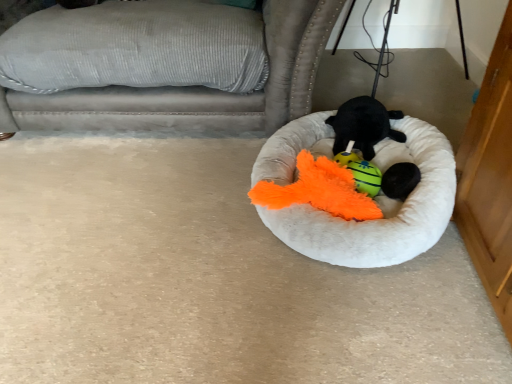
Where is `free space between gray corduroy couch at upper left and white fluffy dog bed at center`? The image size is (512, 384). free space between gray corduroy couch at upper left and white fluffy dog bed at center is located at coordinates (152, 180).